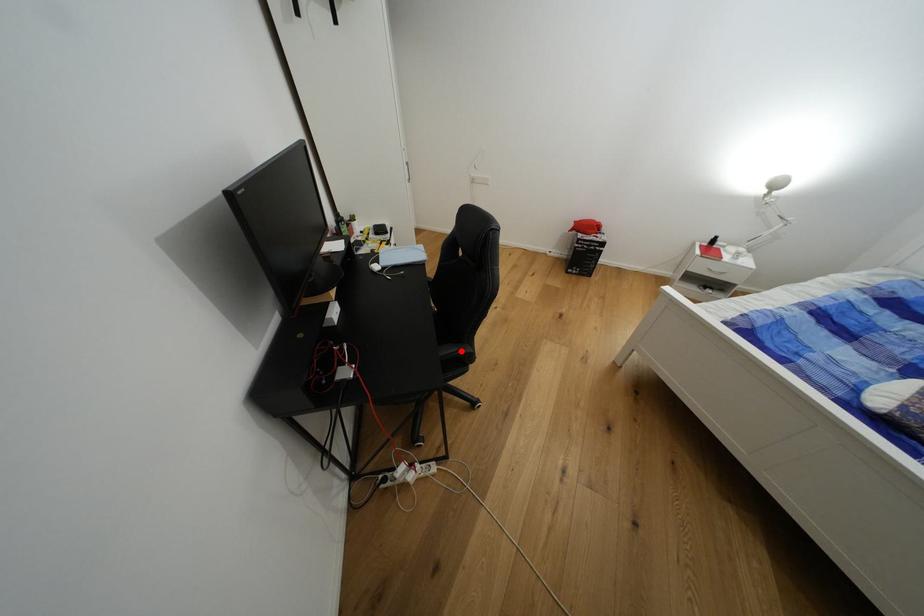
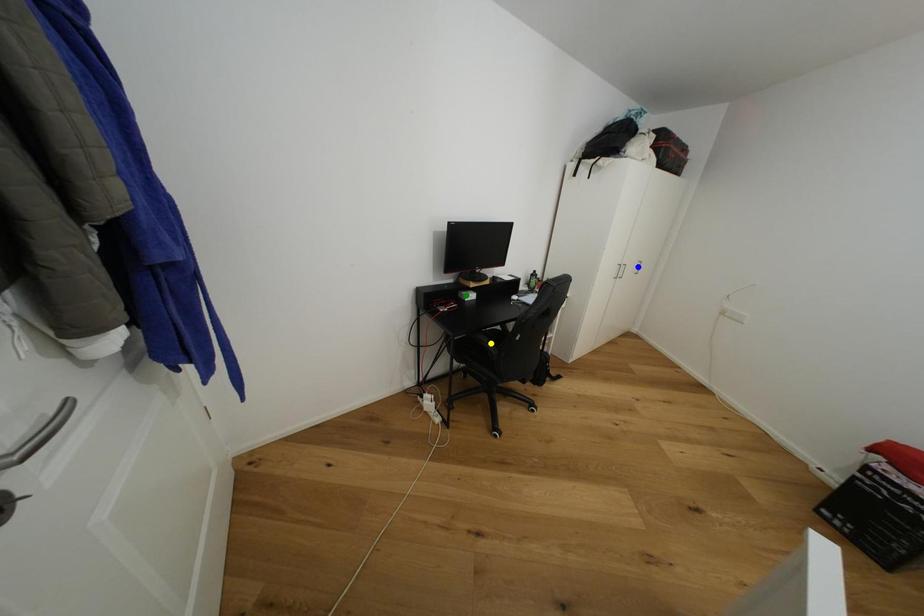
Question: I am providing you with two images of the same scene from different viewpoints. A red point is marked on the first image. You are given multiple points on the second image. Can you choose the point in image 2 that corresponds to the point in image 1?

Choices:
 (A) yellow point
 (B) blue point
 (C) green point

Answer: (A)